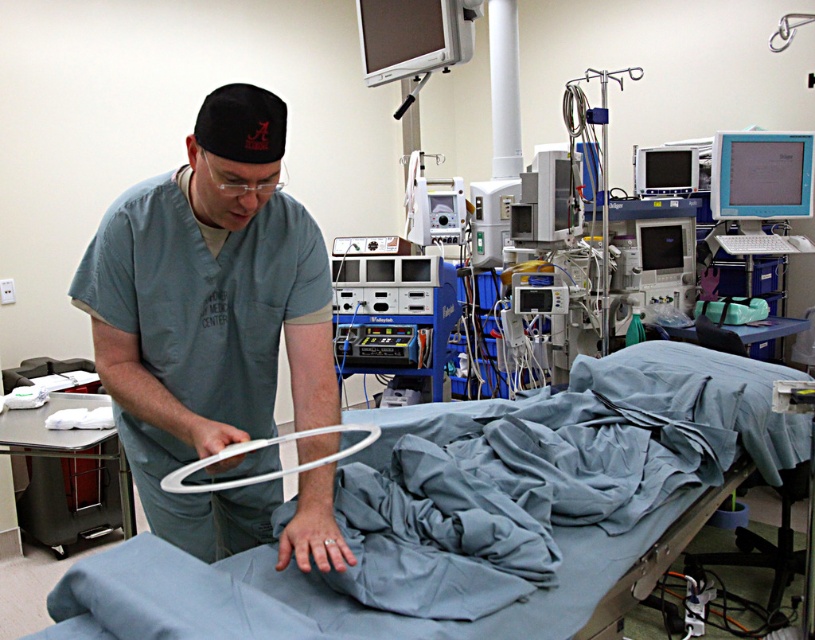
Find the location of a particular element. The width and height of the screenshot is (815, 640). smooth blue fabric at center is located at coordinates pos(472,512).

Which is in front, point (347, 528) or point (225, 131)?

Point (225, 131) is in front.

Where is `smooth blue fabric at center`? This screenshot has height=640, width=815. smooth blue fabric at center is located at coordinates (472, 512).

Between smooth blue fabric at center and white plastic ring at center, which one has more height?

smooth blue fabric at center is taller.

What do you see at coordinates (472, 512) in the screenshot?
I see `smooth blue fabric at center` at bounding box center [472, 512].

Between point (360, 625) and point (271, 474), which one is positioned in front?

Point (360, 625) is more forward.

Find the location of a particular element. The image size is (815, 640). smooth blue fabric at center is located at coordinates (472, 512).

Is gray matte scrubs at center smaller than white plastic ring at center?

No.

Who is shorter, gray matte scrubs at center or white plastic ring at center?

white plastic ring at center is shorter.

What do you see at coordinates (210, 316) in the screenshot?
I see `gray matte scrubs at center` at bounding box center [210, 316].

At what (x,y) coordinates should I click in order to perform the action: click on gray matte scrubs at center. Please return your answer as a coordinate pair (x, y). The width and height of the screenshot is (815, 640). Looking at the image, I should click on (210, 316).